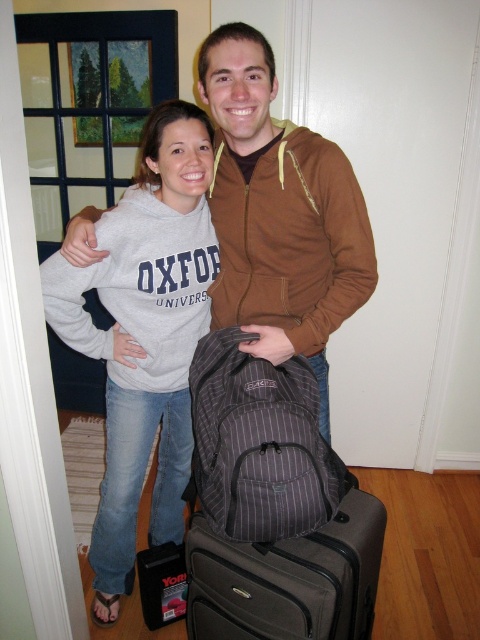
Is gray cotton sweatshirt at center wider than brown fleece sweatshirt at center?

No, gray cotton sweatshirt at center is not wider than brown fleece sweatshirt at center.

Describe the element at coordinates (144, 336) in the screenshot. I see `gray cotton sweatshirt at center` at that location.

Find the location of a particular element. This screenshot has height=640, width=480. gray cotton sweatshirt at center is located at coordinates (144, 336).

Is point (132, 284) farther from viewer compared to point (347, 500)?

No, (132, 284) is in front of (347, 500).

Describe the element at coordinates (144, 336) in the screenshot. The width and height of the screenshot is (480, 640). I see `gray cotton sweatshirt at center` at that location.

You are a GUI agent. You are given a task and a screenshot of the screen. Output one action in this format:
    pyautogui.click(x=<x>, y=<y>)
    Task: Click on the gray cotton sweatshirt at center
    Image resolution: width=480 pixels, height=640 pixels.
    Given the screenshot: What is the action you would take?
    pyautogui.click(x=144, y=336)

Is brown zip-up hoodie at center to the left of gray striped backpack at lower center from the viewer's perspective?

Yes, brown zip-up hoodie at center is to the left of gray striped backpack at lower center.

Is point (348, 292) positioned after point (216, 636)?

No, it is not.

You are a GUI agent. You are given a task and a screenshot of the screen. Output one action in this format:
    pyautogui.click(x=<x>, y=<y>)
    Task: Click on the brown zip-up hoodie at center
    
    Given the screenshot: What is the action you would take?
    pyautogui.click(x=279, y=212)